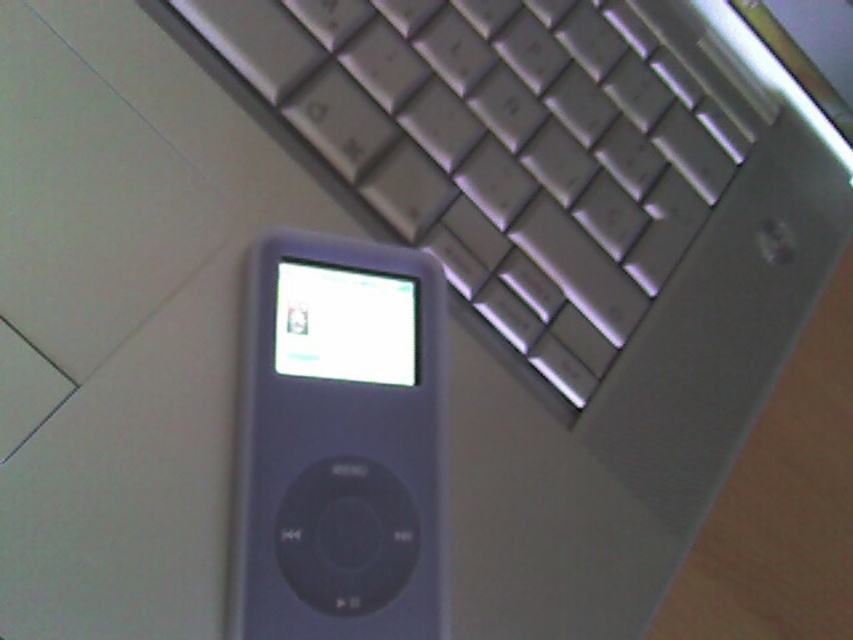
You are trying to place both the satin silver keyboard at center and the slate gray plastic ipod at center into a rectangular box. The box can only fit items that are narrower than 30 centimeters. Based on their widths, can both items fit inside the box?

The satin silver keyboard at center is wider than the slate gray plastic ipod at center. Since the keyboard is wider, it might exceed the 30 cm limit, so both items may not fit inside the box.

You are trying to place a 24 inch ruler between the two points marked as point (456, 246) and another point. Will the ruler fit exactly between them?

The distance between the two points is 23.87 inches, so the 24 inch ruler is slightly longer and will not fit exactly between them.

Please provide the coordinates of the satin silver keyboard at center in the image. The coordinates should be in the format of a point like point (505, 148). Please do not add any extra information besides the coordinates.

The satin silver keyboard at center is located at point (505, 148).